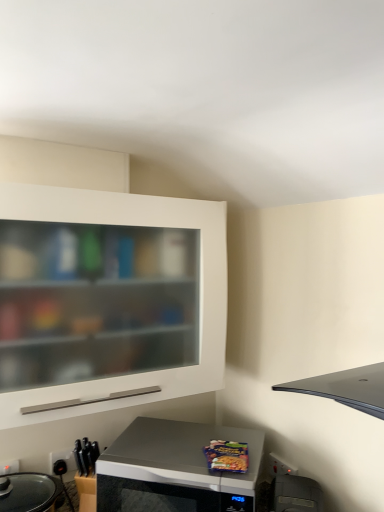
You are a GUI agent. You are given a task and a screenshot of the screen. Output one action in this format:
    pyautogui.click(x=<x>, y=<y>)
    Task: Click on the free space above black plastic toaster at lower right (from a real-world perspective)
    
    Given the screenshot: What is the action you would take?
    pyautogui.click(x=296, y=489)